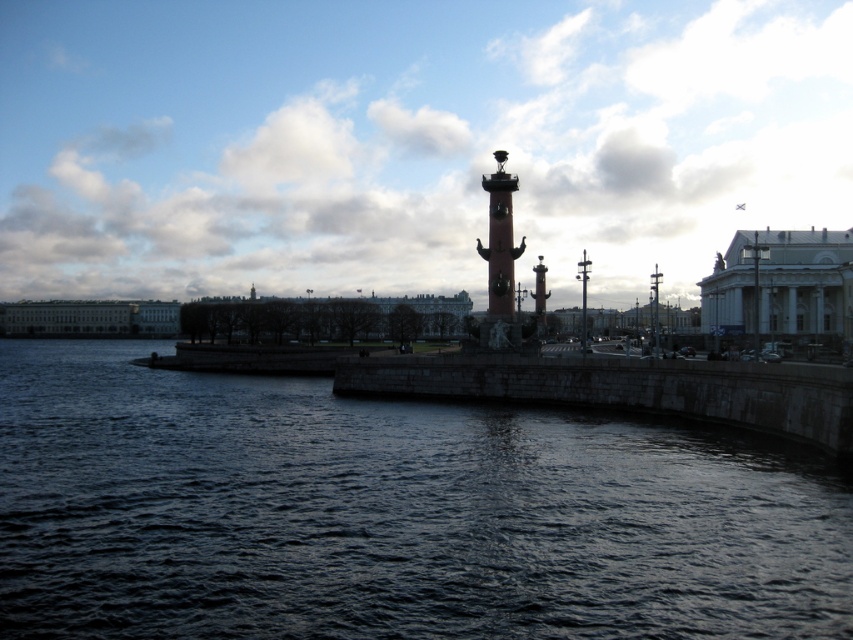
Between point (579, 429) and point (502, 294), which one is positioned behind?

Positioned behind is point (502, 294).

Who is higher up, dark stone water at center or polished bronze bell tower at center?

polished bronze bell tower at center is above.

Between point (555, 556) and point (498, 150), which one is positioned behind?

Point (498, 150)

At what (x,y) coordinates should I click in order to perform the action: click on dark stone water at center. Please return your answer as a coordinate pair (x, y). Looking at the image, I should click on (392, 513).